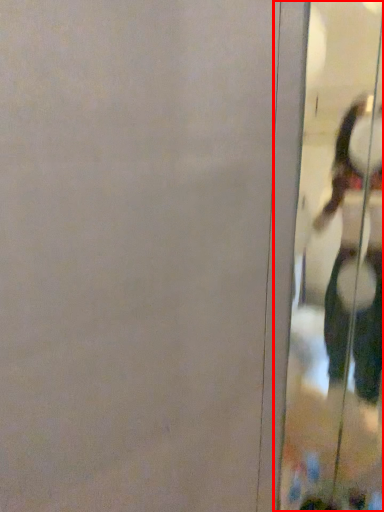
Question: From the image's perspective, what is the correct spatial relationship of screen door (annotated by the red box) in relation to person?

Choices:
 (A) above
 (B) below

Answer: (A)